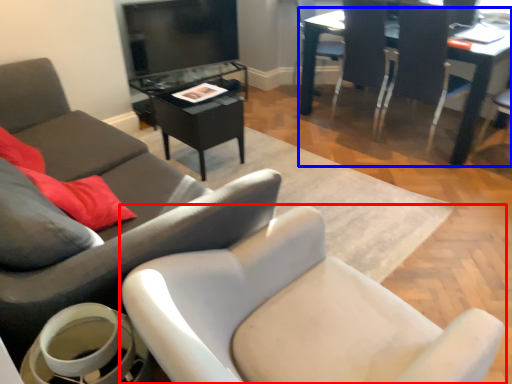
Question: Which point is closer to the camera, chair (highlighted by a red box) or table (highlighted by a blue box)?

Choices:
 (A) chair
 (B) table

Answer: (A)